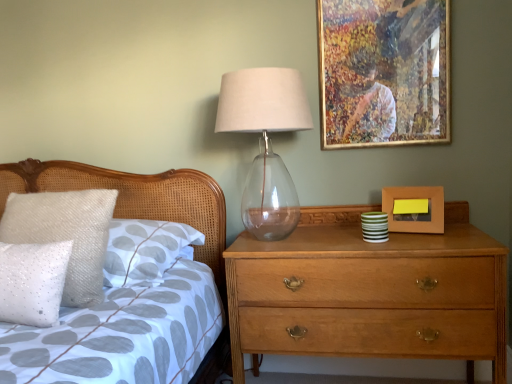
What are the coordinates of `vacant area in front of wooden picture frame at right, arranged as the 2th picture frame when viewed from the top` in the screenshot? It's located at (436, 238).